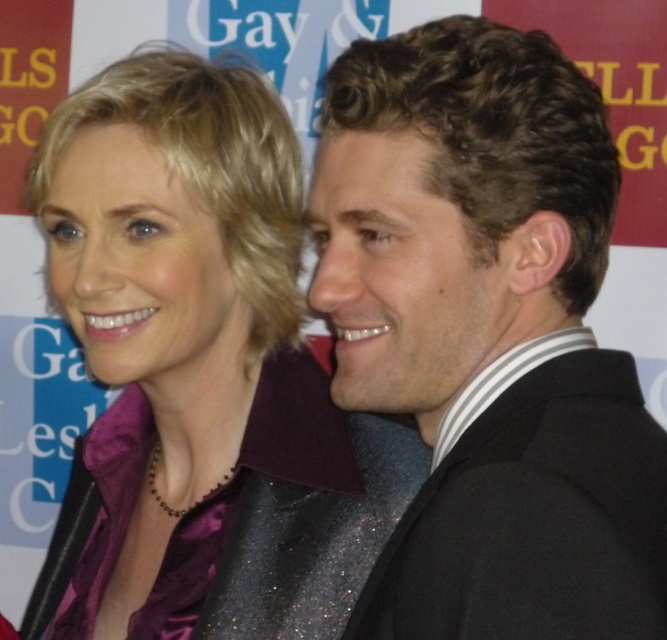
Question: Among these points, which one is nearest to the camera?

Choices:
 (A) click(354, 173)
 (B) click(283, 253)

Answer: (A)

Question: Can you confirm if shiny black suit at right is positioned above purple satin blouse at center?

Choices:
 (A) no
 (B) yes

Answer: (B)

Question: Does shiny black suit at right have a lesser width compared to purple satin blouse at center?

Choices:
 (A) no
 (B) yes

Answer: (B)

Question: Which object appears closest to the camera in this image?

Choices:
 (A) purple satin blouse at center
 (B) shiny black suit at right

Answer: (B)

Question: Is shiny black suit at right wider than purple satin blouse at center?

Choices:
 (A) no
 (B) yes

Answer: (A)